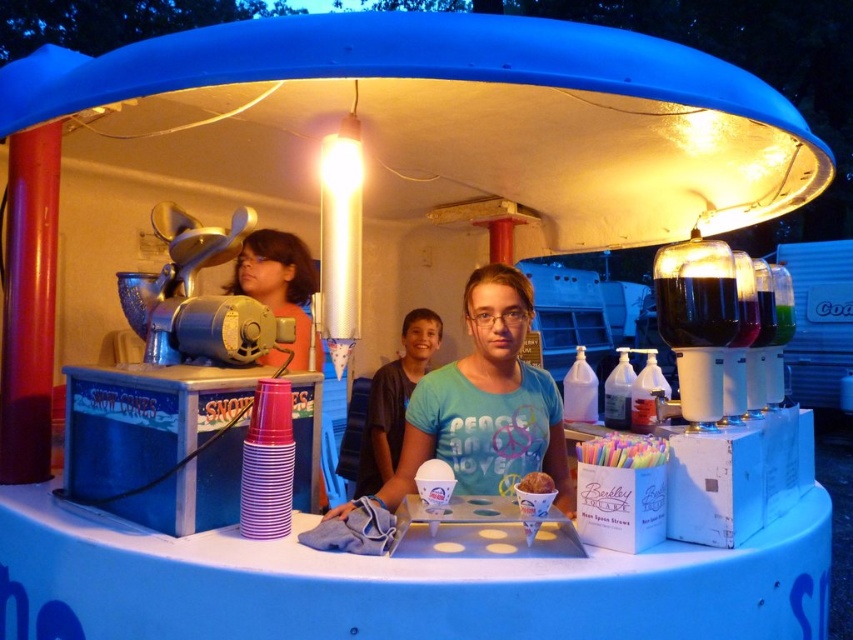
Consider the image. Is green matte t-shirt at center above golden brown pastry at center?

Correct, green matte t-shirt at center is located above golden brown pastry at center.

Which of these two, green matte t-shirt at center or golden brown pastry at center, stands taller?

green matte t-shirt at center is taller.

Does point (398, 392) lie in front of point (527, 477)?

No, (398, 392) is further to viewer.

Locate an element on the screen. green matte t-shirt at center is located at coordinates (393, 400).

Can you confirm if blue cotton shirt at center is positioned to the right of matte black hair at center?

Correct, you'll find blue cotton shirt at center to the right of matte black hair at center.

Can you confirm if blue cotton shirt at center is shorter than matte black hair at center?

No, blue cotton shirt at center is not shorter than matte black hair at center.

Is point (412, 465) farther from viewer compared to point (276, 294)?

No.

Locate an element on the screen. Image resolution: width=853 pixels, height=640 pixels. blue cotton shirt at center is located at coordinates (486, 403).

Between matte black hair at center and green matte t-shirt at center, which one has less height?

With less height is matte black hair at center.

Is matte black hair at center further to camera compared to green matte t-shirt at center?

No, it is in front of green matte t-shirt at center.

Locate an element on the screen. matte black hair at center is located at coordinates (277, 282).

Locate an element on the screen. matte black hair at center is located at coordinates (277, 282).